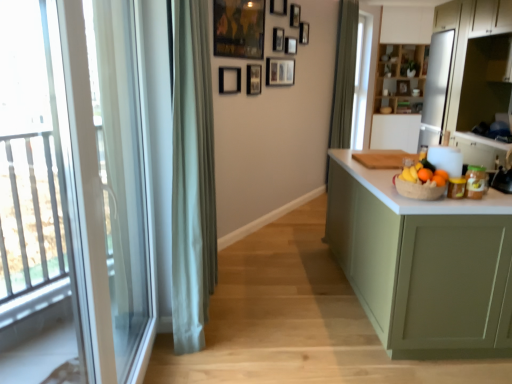
This screenshot has height=384, width=512. I want to click on vacant space to the left of orange matte at right, which is counted as the 2th orange, starting from the right, so click(x=409, y=198).